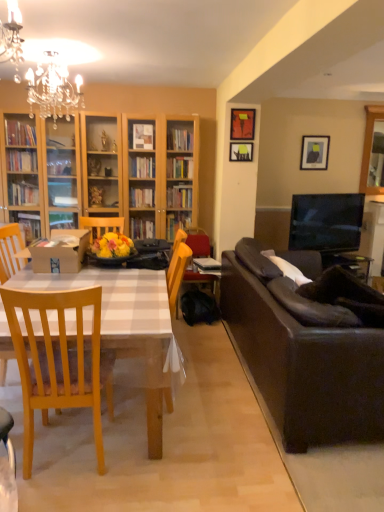
Question: Is dark brown leather couch at right positioned beyond the bounds of wooden picture frame at upper center, which appears as the second picture frame when viewed from the front?

Choices:
 (A) no
 (B) yes

Answer: (B)

Question: Could you tell me if dark brown leather couch at right is facing wooden picture frame at upper center, acting as the 3th picture frame starting from the right?

Choices:
 (A) yes
 (B) no

Answer: (B)

Question: Does dark brown leather couch at right have a lesser width compared to wooden picture frame at upper center, the second picture frame viewed from the back?

Choices:
 (A) yes
 (B) no

Answer: (B)

Question: From the image's perspective, is dark brown leather couch at right beneath wooden picture frame at upper center, acting as the 3th picture frame starting from the right?

Choices:
 (A) yes
 (B) no

Answer: (A)

Question: Are dark brown leather couch at right and wooden picture frame at upper center, which appears as the second picture frame when viewed from the front, far apart?

Choices:
 (A) yes
 (B) no

Answer: (A)

Question: Is the position of dark brown leather couch at right less distant than that of wooden picture frame at upper center, the second picture frame viewed from the back?

Choices:
 (A) no
 (B) yes

Answer: (B)

Question: From a real-world perspective, is wooden armchair at center over wooden table at left?

Choices:
 (A) no
 (B) yes

Answer: (B)

Question: Considering the relative sizes of wooden armchair at center and wooden table at left in the image provided, is wooden armchair at center taller than wooden table at left?

Choices:
 (A) no
 (B) yes

Answer: (B)

Question: Is wooden armchair at center smaller than wooden table at left?

Choices:
 (A) no
 (B) yes

Answer: (B)

Question: Does wooden armchair at center have a lesser height compared to wooden table at left?

Choices:
 (A) no
 (B) yes

Answer: (A)

Question: Can we say wooden armchair at center lies outside wooden table at left?

Choices:
 (A) no
 (B) yes

Answer: (B)

Question: Could you tell me if wooden armchair at center is turned towards wooden table at left?

Choices:
 (A) no
 (B) yes

Answer: (A)

Question: Is crystal chandelier at upper left outside wooden picture frame at upper center, the 1th picture frame from the left?

Choices:
 (A) yes
 (B) no

Answer: (A)